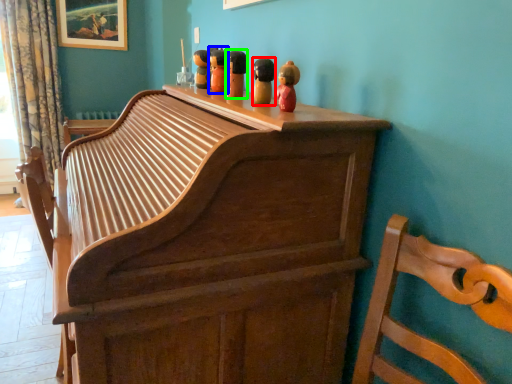
Question: Considering the real-world distances, which object is farthest from toy (highlighted by a red box)? toy (highlighted by a blue box) or toy (highlighted by a green box)?

Choices:
 (A) toy
 (B) toy

Answer: (A)